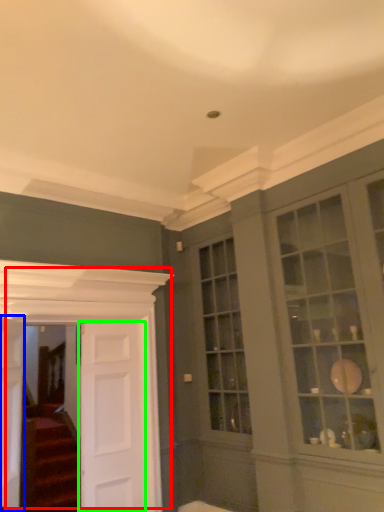
Question: Based on their relative distances, which object is nearer to door (highlighted by a red box)? Choose from door (highlighted by a blue box) and door (highlighted by a green box).

Choices:
 (A) door
 (B) door

Answer: (B)